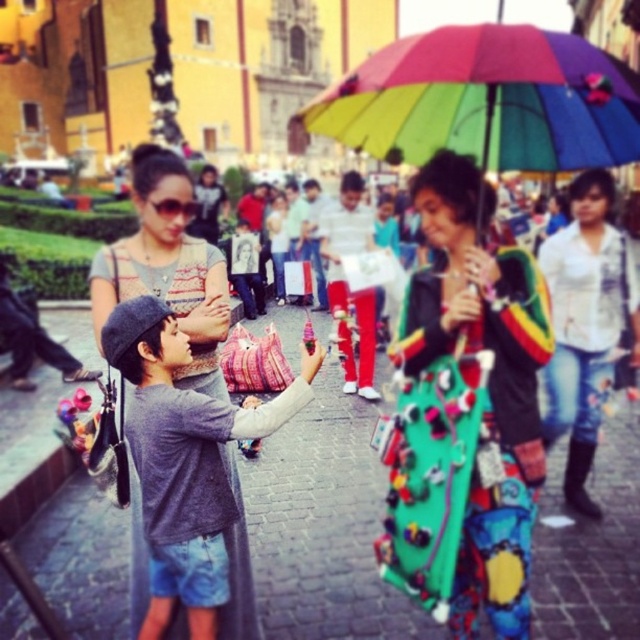
Question: Which object is closer to the camera taking this photo?

Choices:
 (A) matte gray sweater at center
 (B) gray cotton shirt at center
 (C) white textured shirt at upper right
 (D) multicolored fabric umbrella at center

Answer: (D)

Question: Can you confirm if rainbow fabric umbrella at center is positioned above white textured shirt at upper right?

Choices:
 (A) yes
 (B) no

Answer: (A)

Question: Does gray cotton shirt at center appear under white textured shirt at upper right?

Choices:
 (A) yes
 (B) no

Answer: (A)

Question: Which of the following is the closest to the observer?

Choices:
 (A) click(x=140, y=176)
 (B) click(x=432, y=81)
 (C) click(x=168, y=365)
 (D) click(x=620, y=356)

Answer: (C)

Question: Is matte gray sweater at center wider than white textured shirt at upper right?

Choices:
 (A) yes
 (B) no

Answer: (A)

Question: Which point appears farthest from the camera in this image?

Choices:
 (A) 147,163
 (B) 593,186

Answer: (B)